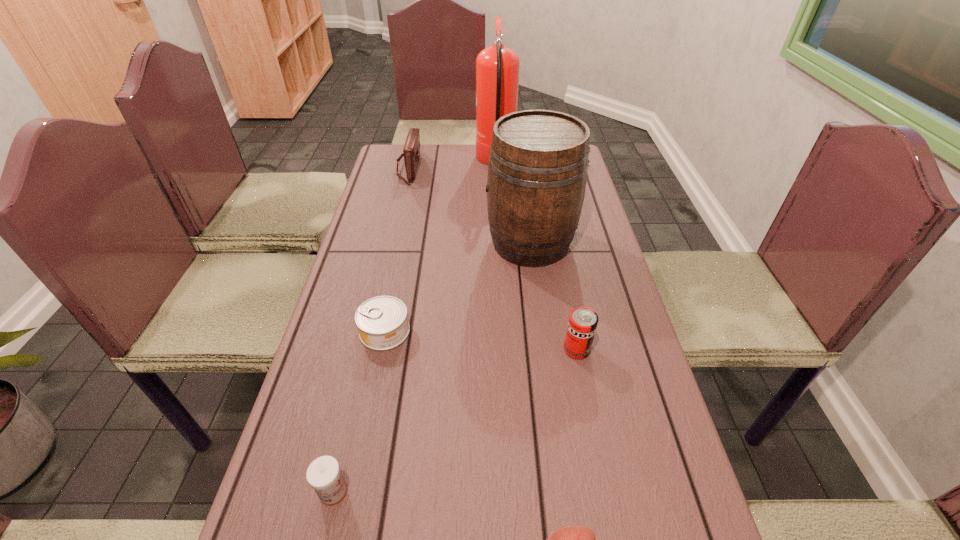
Where is `vacant area that lies between the right can and the shoulder bag`? The height and width of the screenshot is (540, 960). vacant area that lies between the right can and the shoulder bag is located at coordinates (492, 259).

This screenshot has height=540, width=960. What are the coordinates of `free space that is in between the tallest object and the shoulder bag` in the screenshot? It's located at (452, 165).

This screenshot has height=540, width=960. Find the location of `vacant space that's between the medicine and the tallest object`. vacant space that's between the medicine and the tallest object is located at coordinates (415, 327).

You are a GUI agent. You are given a task and a screenshot of the screen. Output one action in this format:
    pyautogui.click(x=<x>, y=<y>)
    Task: Click on the empty location between the tallest object and the medicine
    
    Given the screenshot: What is the action you would take?
    pyautogui.click(x=415, y=327)

Point out which object is positioned as the nearest to the shorter can. Please provide its 2D coordinates. Your answer should be formatted as a tuple, i.e. [(x, y)], where the tuple contains the x and y coordinates of a point satisfying the conditions above.

[(538, 162)]

Choose which object is the fifth nearest neighbor to the tallest object. Please provide its 2D coordinates. Your answer should be formatted as a tuple, i.e. [(x, y)], where the tuple contains the x and y coordinates of a point satisfying the conditions above.

[(323, 474)]

Find the location of a particular element. This screenshot has height=540, width=960. vacant space that satisfies the following two spatial constraints: 1. on the side of the cider near the bung hole; 2. on the front side of the shortest object is located at coordinates (541, 331).

This screenshot has height=540, width=960. I want to click on free location that satisfies the following two spatial constraints: 1. on the front flap of the taller can; 2. on the right side of the shoulder bag, so click(367, 349).

Image resolution: width=960 pixels, height=540 pixels. What are the coordinates of `free space that satisfies the following two spatial constraints: 1. on the front side of the taller can; 2. on the left side of the shortest object` in the screenshot? It's located at [381, 349].

Identify the location of vacant space that satisfies the following two spatial constraints: 1. on the front flap of the right can; 2. on the left side of the shoulder bag. (367, 349).